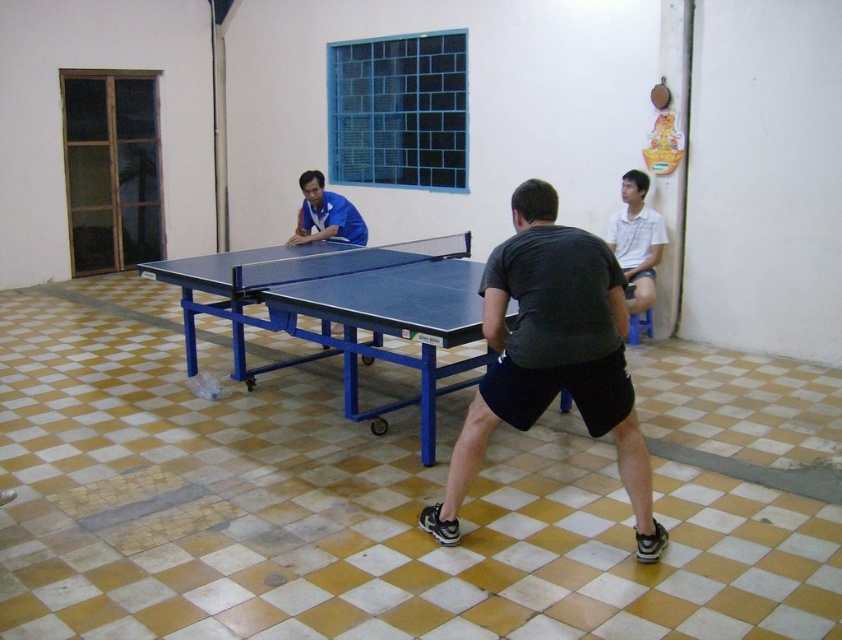
Does dark gray fabric shirt at center have a lesser width compared to white cotton shirt at upper right?

In fact, dark gray fabric shirt at center might be wider than white cotton shirt at upper right.

Can you confirm if dark gray fabric shirt at center is positioned to the left of white cotton shirt at upper right?

Correct, you'll find dark gray fabric shirt at center to the left of white cotton shirt at upper right.

Find the location of a particular element. This screenshot has height=640, width=842. dark gray fabric shirt at center is located at coordinates pyautogui.click(x=552, y=355).

Find the location of a particular element. The width and height of the screenshot is (842, 640). dark gray fabric shirt at center is located at coordinates (552, 355).

From the picture: Who is positioned more to the left, dark gray fabric shirt at center or matte blue shirt at center?

Positioned to the left is matte blue shirt at center.

Is dark gray fabric shirt at center shorter than matte blue shirt at center?

No.

The image size is (842, 640). Identify the location of dark gray fabric shirt at center. (552, 355).

Does white cotton shirt at upper right have a larger size compared to matte blue shirt at center?

Incorrect, white cotton shirt at upper right is not larger than matte blue shirt at center.

Is white cotton shirt at upper right taller than matte blue shirt at center?

Yes, white cotton shirt at upper right is taller than matte blue shirt at center.

Is point (633, 257) closer to camera compared to point (347, 236)?

No, it is not.

The image size is (842, 640). I want to click on white cotton shirt at upper right, so click(637, 241).